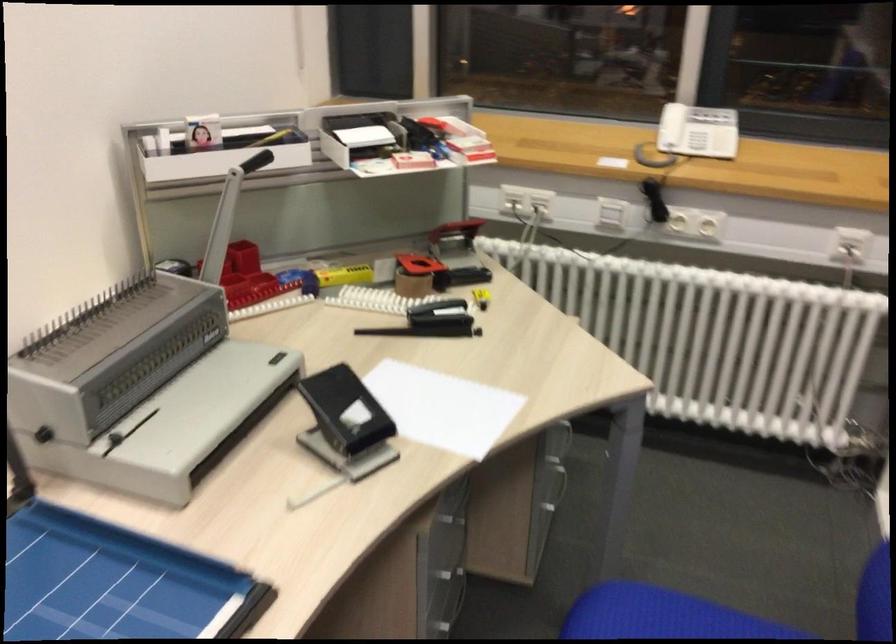
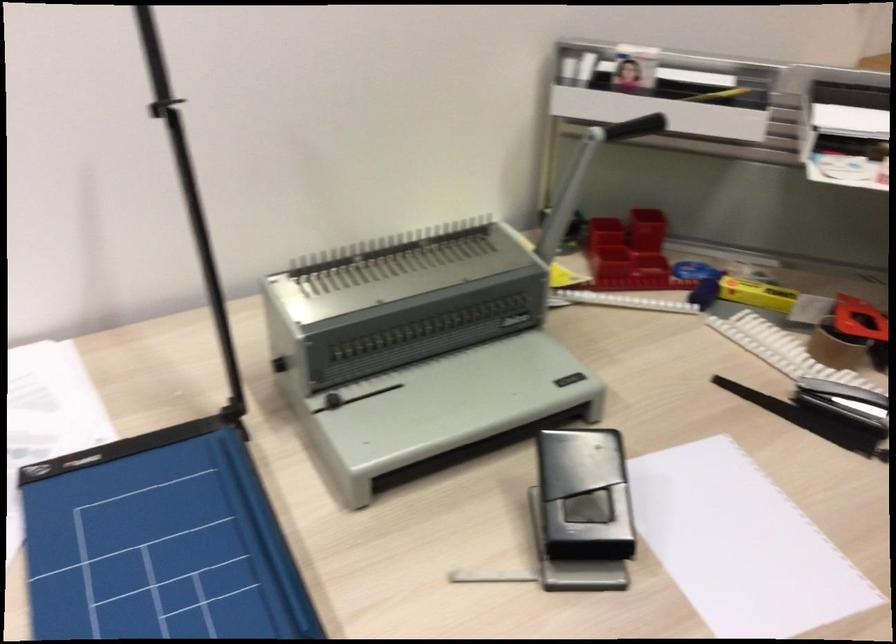
Question: Based on the continuous images, in which direction is the camera rotating? Reply with the corresponding letter.

Choices:
 (A) Left
 (B) Right
 (C) Up
 (D) Down

Answer: (A)